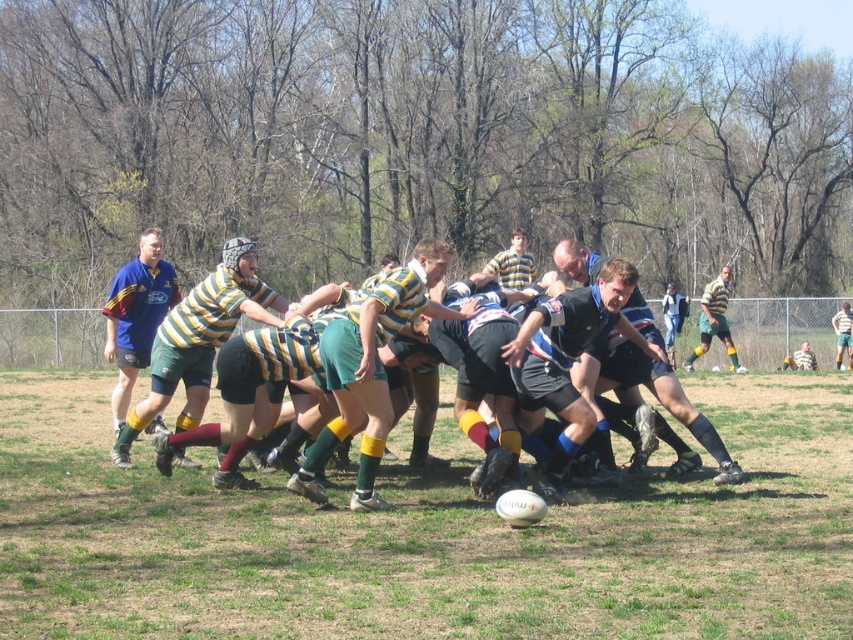
Question: Is green grass at center below green striped jersey at center?

Choices:
 (A) yes
 (B) no

Answer: (A)

Question: Is the position of green grass at center less distant than that of matte blue shirt at left?

Choices:
 (A) no
 (B) yes

Answer: (B)

Question: Which point is farther to the camera?

Choices:
 (A) green grass at center
 (B) matte green shorts at center

Answer: (B)

Question: Considering the real-world distances, which object is closest to the matte green shorts at center?

Choices:
 (A) matte black shorts at center
 (B) matte blue shirt at left
 (C) yellow-green striped jersey at center
 (D) green grass at center

Answer: (B)

Question: Considering the real-world distances, which object is farthest from the matte black shorts at center?

Choices:
 (A) yellow-green striped jersey at center
 (B) green striped jersey at center
 (C) matte green shorts at center
 (D) green grass at center

Answer: (A)

Question: Does matte green shorts at center have a lesser width compared to matte blue shirt at left?

Choices:
 (A) no
 (B) yes

Answer: (B)